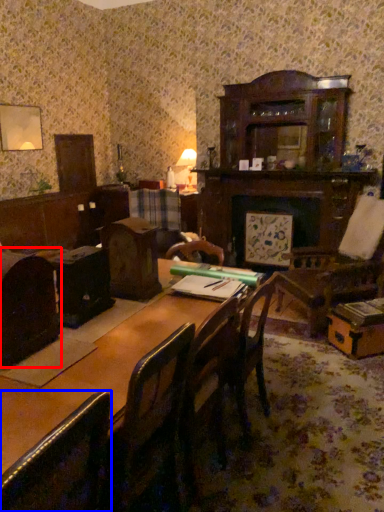
Question: Which of the following is the farthest to the observer, chair (highlighted by a red box) or chair (highlighted by a blue box)?

Choices:
 (A) chair
 (B) chair

Answer: (A)